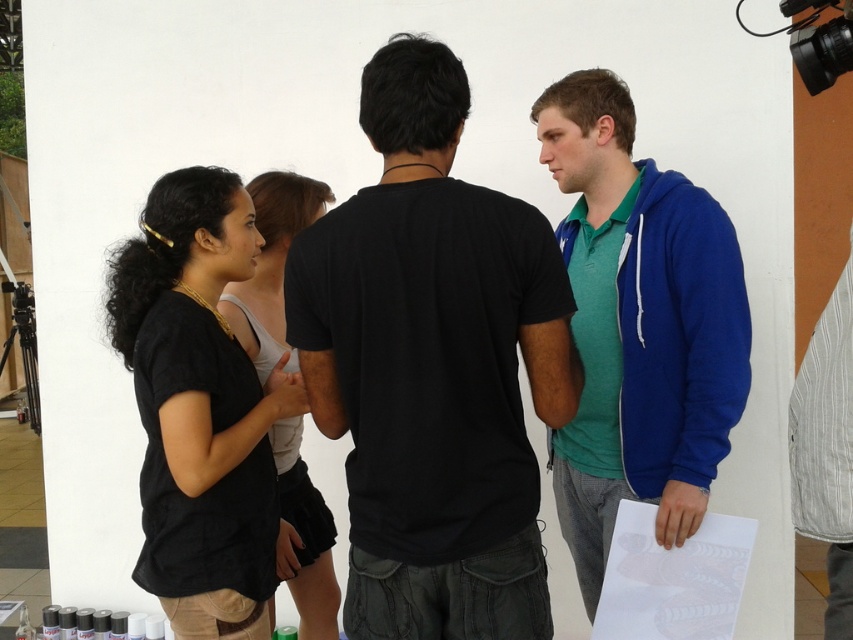
Question: Does blue fleece jacket at right appear on the left side of gray striped shirt at right?

Choices:
 (A) yes
 (B) no

Answer: (A)

Question: Which point is farther to the camera?

Choices:
 (A) black matte t-shirt at center
 (B) black linen shirt at center
 (C) black matte shirt at center
 (D) gray striped shirt at right

Answer: (C)

Question: Which object is farther from the camera taking this photo?

Choices:
 (A) black matte t-shirt at center
 (B) black linen shirt at center
 (C) black matte shirt at center
 (D) blue fleece jacket at right

Answer: (C)

Question: Based on their relative distances, which object is farther from the blue fleece jacket at right?

Choices:
 (A) black matte shirt at center
 (B) black matte t-shirt at center
 (C) gray striped shirt at right
 (D) black linen shirt at center

Answer: (D)

Question: Is black linen shirt at center to the right of black matte shirt at center from the viewer's perspective?

Choices:
 (A) yes
 (B) no

Answer: (B)

Question: Where is blue fleece jacket at right located in relation to gray striped shirt at right in the image?

Choices:
 (A) above
 (B) below

Answer: (A)